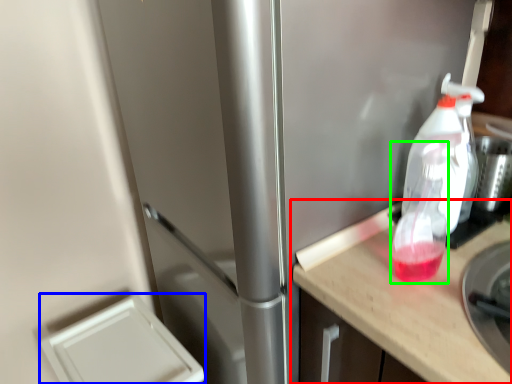
Question: Which object is the farthest from countertop (highlighted by a red box)? Choose among these: appliance (highlighted by a blue box) or bottle (highlighted by a green box).

Choices:
 (A) appliance
 (B) bottle

Answer: (A)